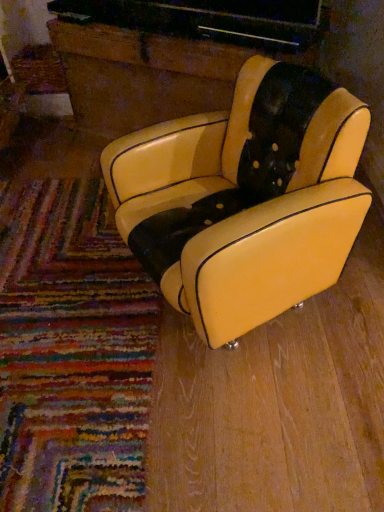
This screenshot has height=512, width=384. Find the location of `vacant space in front of yellow leather chair at center`. vacant space in front of yellow leather chair at center is located at coordinates (273, 418).